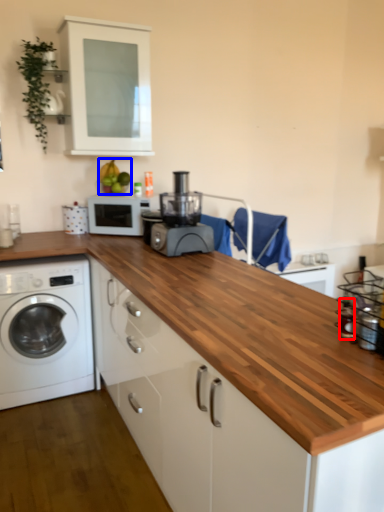
Question: Among these objects, which one is farthest to the camera, bottle (highlighted by a red box) or fruit (highlighted by a blue box)?

Choices:
 (A) bottle
 (B) fruit

Answer: (B)